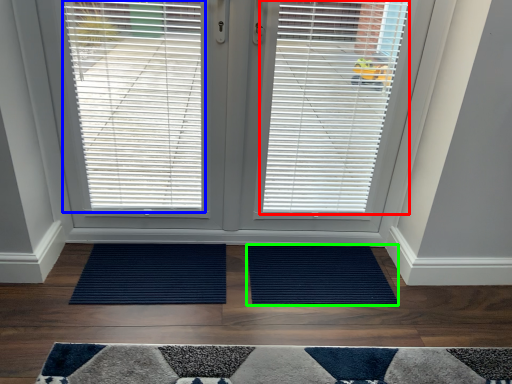
Question: Which is farther away from window blind (highlighted by a red box)? window blind (highlighted by a blue box) or doormat (highlighted by a green box)?

Choices:
 (A) window blind
 (B) doormat

Answer: (B)